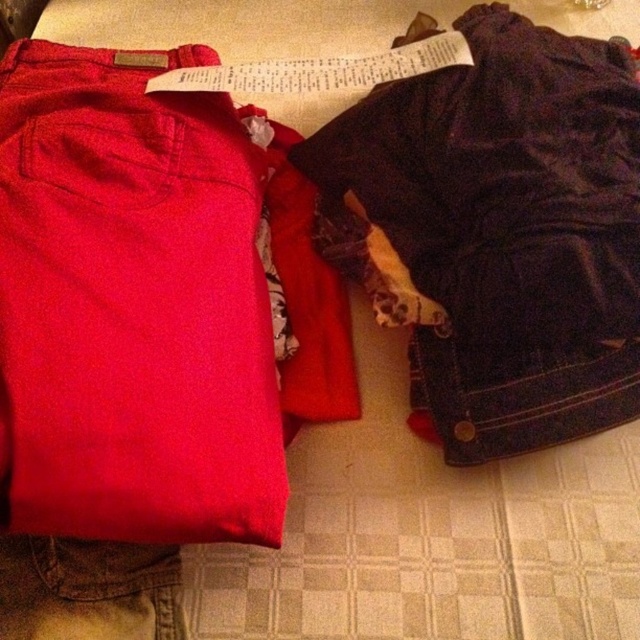
You need to pack your luggage and have limited space. You have to choose between the matte cotton pants at left and the dark blue corduroy shorts at right. Which one takes up more space?

The matte cotton pants at left is bigger than dark blue corduroy shorts at right, so it takes up more space. Therefore, the matte cotton pants at left would take up more space.